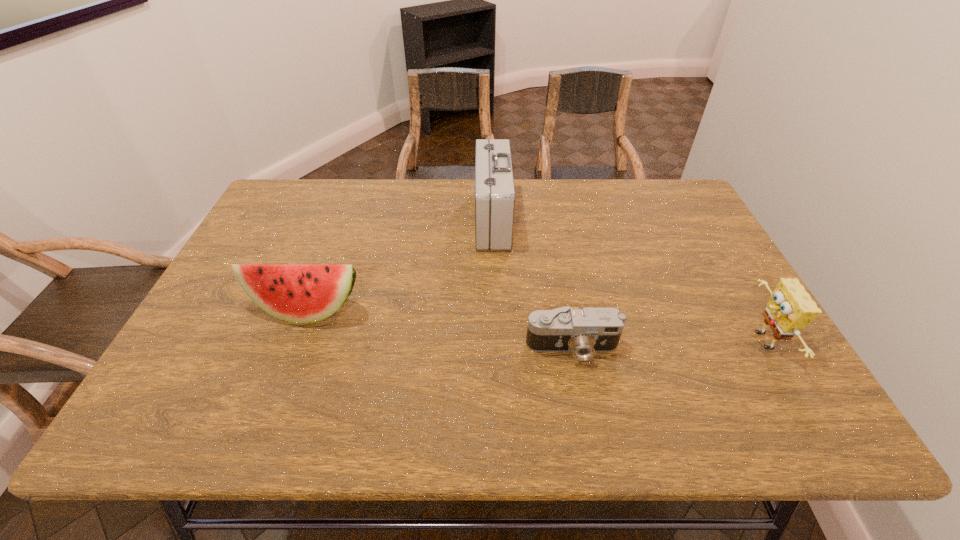
At what (x,y) coordinates should I click in order to perform the action: click on the farthest object. Please return your answer as a coordinate pair (x, y). The width and height of the screenshot is (960, 540). Looking at the image, I should click on (494, 184).

You are a GUI agent. You are given a task and a screenshot of the screen. Output one action in this format:
    pyautogui.click(x=<x>, y=<y>)
    Task: Click on the tallest object
    This screenshot has height=540, width=960.
    Given the screenshot: What is the action you would take?
    pyautogui.click(x=494, y=184)

The image size is (960, 540). In order to click on the leftmost object in this screenshot , I will do `click(298, 293)`.

Where is `the rightmost object`? The width and height of the screenshot is (960, 540). the rightmost object is located at coordinates pos(790,308).

At what (x,y) coordinates should I click in order to perform the action: click on the shortest object. Please return your answer as a coordinate pair (x, y). Image resolution: width=960 pixels, height=540 pixels. Looking at the image, I should click on (583, 332).

Identify the location of camera. (583, 332).

Identify the location of vacant space located 0.330m on the front-facing side of the farthest object. The height and width of the screenshot is (540, 960). (370, 219).

Where is `free space located on the front-facing side of the farthest object`? The width and height of the screenshot is (960, 540). free space located on the front-facing side of the farthest object is located at coordinates (382, 219).

At what (x,y) coordinates should I click in order to perform the action: click on vacant space located 0.090m on the front-facing side of the farthest object. Please return your answer as a coordinate pair (x, y). Looking at the image, I should click on (446, 219).

Identify the location of free space located on the outer rind of the leftmost object. This screenshot has height=540, width=960. (291, 352).